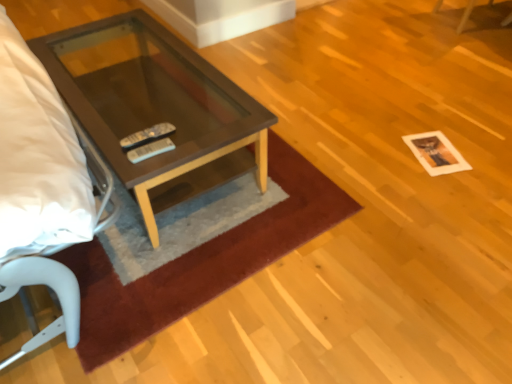
Question: From the image's perspective, would you say white paper at lower right is shown under brown plush rug at center?

Choices:
 (A) no
 (B) yes

Answer: (A)

Question: Could you tell me if white paper at lower right is turned towards brown plush rug at center?

Choices:
 (A) yes
 (B) no

Answer: (B)

Question: From a real-world perspective, is white paper at lower right beneath brown plush rug at center?

Choices:
 (A) no
 (B) yes

Answer: (B)

Question: Is white paper at lower right wider than brown plush rug at center?

Choices:
 (A) no
 (B) yes

Answer: (A)

Question: Is white paper at lower right shorter than brown plush rug at center?

Choices:
 (A) no
 (B) yes

Answer: (B)

Question: Considering the relative sizes of white paper at lower right and brown plush rug at center in the image provided, is white paper at lower right taller than brown plush rug at center?

Choices:
 (A) no
 (B) yes

Answer: (A)

Question: Considering the relative sizes of brown plush rug at center and matte brown glass coffee table at center in the image provided, is brown plush rug at center bigger than matte brown glass coffee table at center?

Choices:
 (A) yes
 (B) no

Answer: (B)

Question: Is the position of brown plush rug at center less distant than that of matte brown glass coffee table at center?

Choices:
 (A) yes
 (B) no

Answer: (A)

Question: Is brown plush rug at center taller than matte brown glass coffee table at center?

Choices:
 (A) no
 (B) yes

Answer: (A)

Question: Are brown plush rug at center and matte brown glass coffee table at center located far from each other?

Choices:
 (A) yes
 (B) no

Answer: (B)

Question: From a real-world perspective, is brown plush rug at center located higher than matte brown glass coffee table at center?

Choices:
 (A) no
 (B) yes

Answer: (A)

Question: Is brown plush rug at center surrounding matte brown glass coffee table at center?

Choices:
 (A) yes
 (B) no

Answer: (B)

Question: From a real-world perspective, is matte brown glass coffee table at center below white paper at lower right?

Choices:
 (A) yes
 (B) no

Answer: (B)